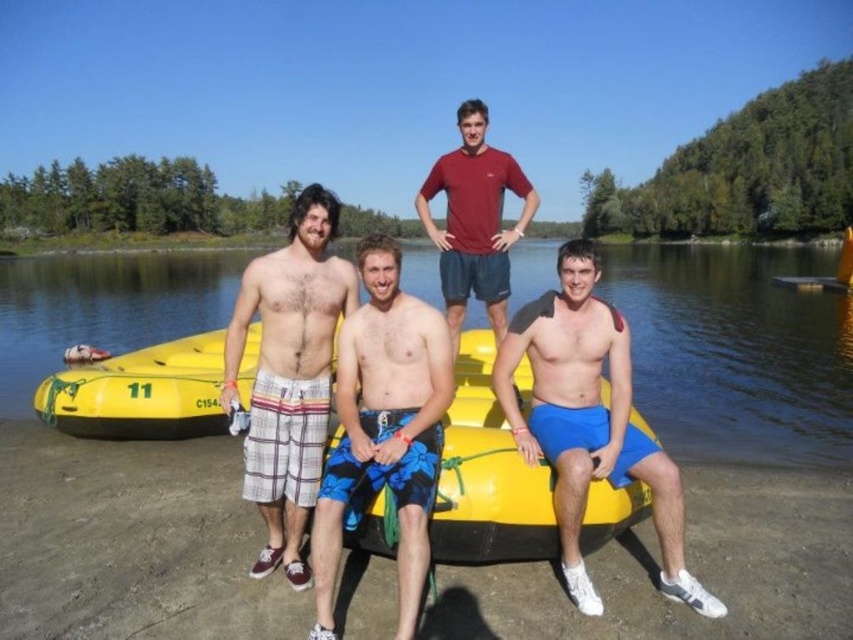
At what (x,y) coordinates should I click in order to perform the action: click on blue fabric shorts at center. Please return your answer as a coordinate pair (x, y). This screenshot has height=640, width=853. Looking at the image, I should click on (589, 422).

Which is in front, point (496, 394) or point (258, 301)?

Point (496, 394)

Is point (670, 509) positioned after point (321, 374)?

No, (670, 509) is in front of (321, 374).

You are a GUI agent. You are given a task and a screenshot of the screen. Output one action in this format:
    pyautogui.click(x=<x>, y=<y>)
    Task: Click on the blue fabric shorts at center
    This screenshot has width=853, height=640.
    Given the screenshot: What is the action you would take?
    [x=589, y=422]

Is point (10, 291) in front of point (318, 444)?

No.

Is yellow rubber raft at center shorter than plaid shorts at center?

No, yellow rubber raft at center is not shorter than plaid shorts at center.

Where is `yellow rubber raft at center`? This screenshot has width=853, height=640. yellow rubber raft at center is located at coordinates (735, 349).

Is point (677, 296) in front of point (340, 452)?

That is False.

Is yellow rubber raft at center taller than blue printed shorts at center?

Correct, yellow rubber raft at center is much taller as blue printed shorts at center.

Does point (148, 337) come in front of point (338, 340)?

No.

Where is `yellow rubber raft at center`? The image size is (853, 640). yellow rubber raft at center is located at coordinates (735, 349).